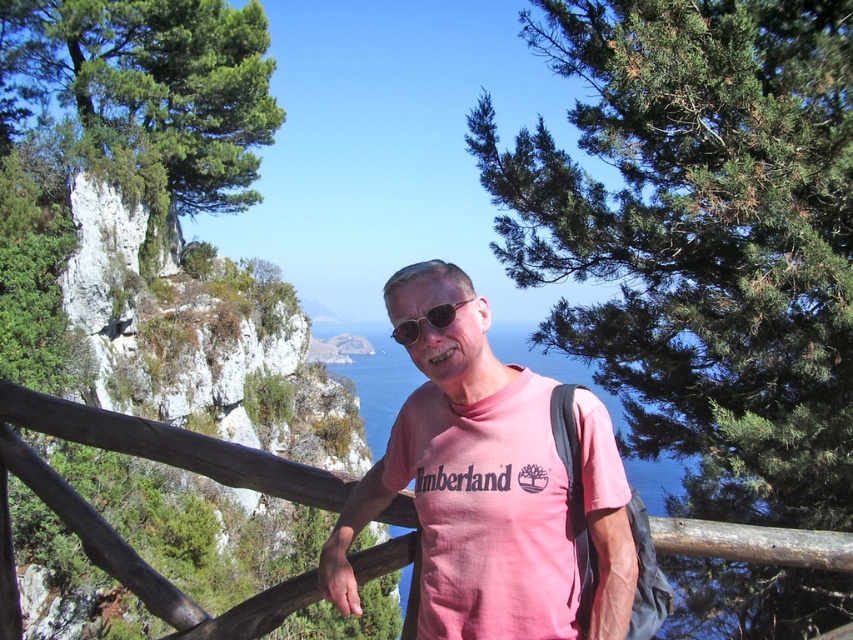
Find the location of a particular element. This screenshot has height=640, width=853. wooden at center is located at coordinates (166, 464).

Which is behind, point (0, 454) or point (454, 304)?

Point (0, 454)

Locate an element on the screen. This screenshot has width=853, height=640. wooden at center is located at coordinates (166, 464).

Is point (805, 387) in front of point (347, 534)?

That is False.

Which is above, green needle-like pine at upper center or pink cotton shirt at center?

green needle-like pine at upper center is above.

The image size is (853, 640). In order to click on green needle-like pine at upper center in this screenshot , I will do `click(701, 237)`.

Looking at this image, does green needle-like pine at upper center have a larger size compared to sunglasses at center?

Yes, green needle-like pine at upper center is bigger than sunglasses at center.

Between green needle-like pine at upper center and sunglasses at center, which one appears on the right side from the viewer's perspective?

Positioned to the right is green needle-like pine at upper center.

Between point (633, 248) and point (401, 340), which one is positioned behind?

Point (633, 248)

At what (x,y) coordinates should I click in order to perform the action: click on green needle-like pine at upper center. Please return your answer as a coordinate pair (x, y). Looking at the image, I should click on (701, 237).